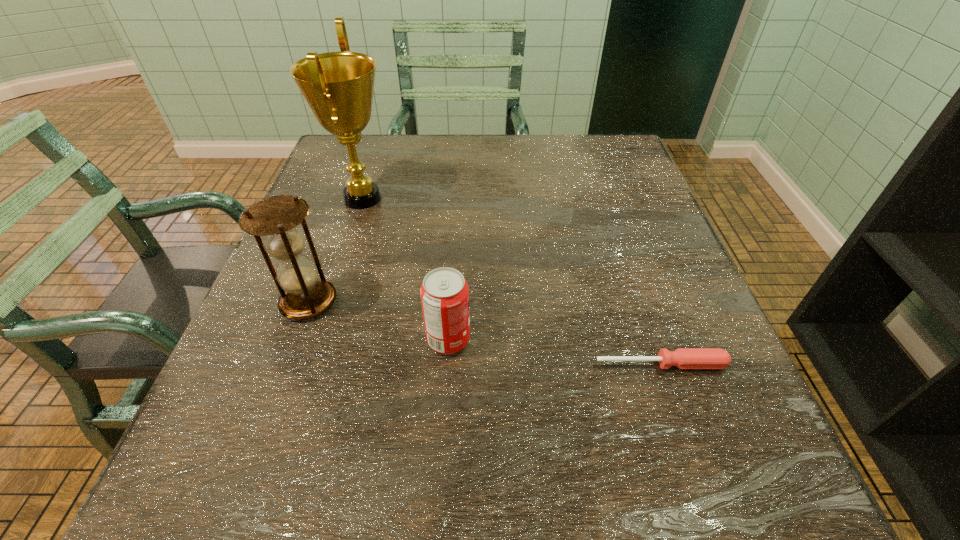
I want to click on vacant area situated on the left of the rightmost object, so 534,364.

The image size is (960, 540). What are the coordinates of `object that is positioned at the far edge` in the screenshot? It's located at (338, 86).

You are a GUI agent. You are given a task and a screenshot of the screen. Output one action in this format:
    pyautogui.click(x=<x>, y=<y>)
    Task: Click on the award situated at the left edge
    This screenshot has width=960, height=540.
    Given the screenshot: What is the action you would take?
    pyautogui.click(x=338, y=86)

Where is `hourglass that is positioned at the left edge`? hourglass that is positioned at the left edge is located at coordinates (303, 296).

The image size is (960, 540). I want to click on object that is at the right edge, so click(x=683, y=358).

Where is `object present at the far left corner`? object present at the far left corner is located at coordinates (338, 86).

Identify the location of vacant area at the far edge of the desktop. This screenshot has width=960, height=540. (479, 156).

You are a GUI agent. You are given a task and a screenshot of the screen. Output one action in this format:
    pyautogui.click(x=<x>, y=<y>)
    Task: Click on the vacant space at the near edge of the desktop
    The width and height of the screenshot is (960, 540).
    Given the screenshot: What is the action you would take?
    pyautogui.click(x=312, y=513)

Locate an element on the screen. This screenshot has height=540, width=960. free location at the left edge is located at coordinates (212, 406).

In the image, there is a desktop. Where is `vacant area at the right edge`? The height and width of the screenshot is (540, 960). vacant area at the right edge is located at coordinates (645, 416).